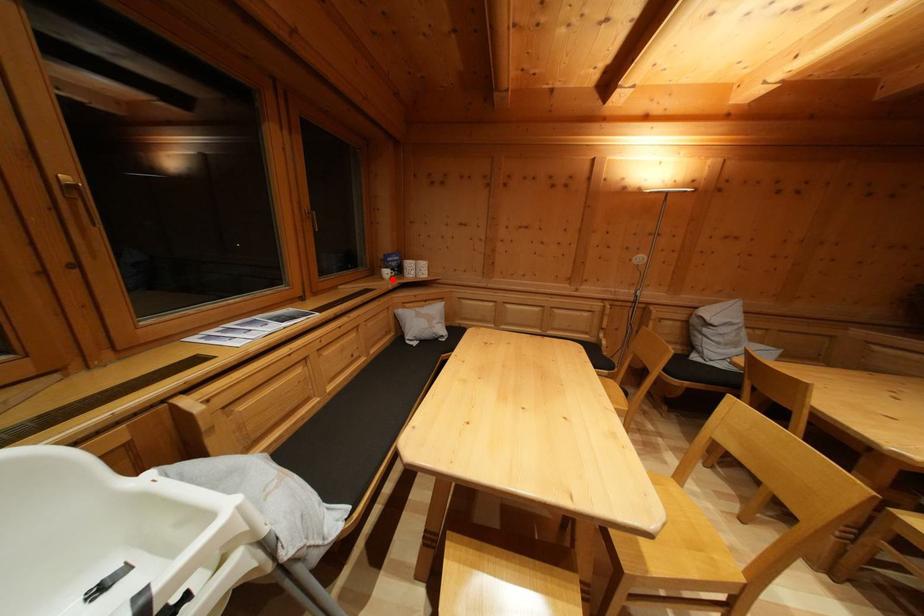
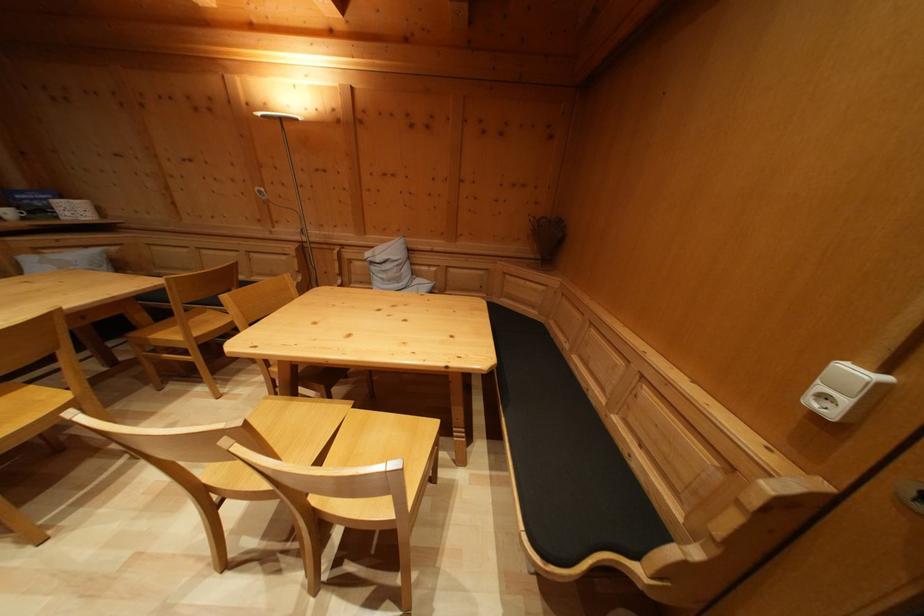
Find the pixel in the second image that matches the highlighted location in the first image.

(14, 219)